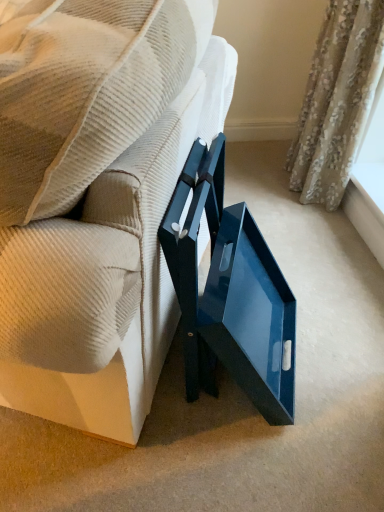
Describe the element at coordinates (337, 100) in the screenshot. I see `floral fabric curtain at upper right` at that location.

Identify the location of white textured window sill at upper right. The image size is (384, 512). (365, 217).

Which of these two, white textured window sill at upper right or floral fabric curtain at upper right, is smaller?

white textured window sill at upper right.

Based on the photo, from the image's perspective, between white textured window sill at upper right and floral fabric curtain at upper right, which one is located above?

floral fabric curtain at upper right.

Can you tell me how much white textured window sill at upper right and floral fabric curtain at upper right differ in facing direction?

white textured window sill at upper right and floral fabric curtain at upper right are facing 0.00149 degrees away from each other.

Can you see glossy blue tray at center touching floral fabric curtain at upper right?

No, glossy blue tray at center is not with floral fabric curtain at upper right.

What's the angular difference between glossy blue tray at center and floral fabric curtain at upper right's facing directions?

23 degrees.

Considering the relative sizes of glossy blue tray at center and floral fabric curtain at upper right in the image provided, is glossy blue tray at center shorter than floral fabric curtain at upper right?

In fact, glossy blue tray at center may be taller than floral fabric curtain at upper right.

Considering the positions of points (122, 277) and (349, 165), is point (122, 277) closer to camera compared to point (349, 165)?

That is True.

Does floral fabric curtain at upper right appear on the right side of glossy blue tray at center?

Yes.

Is floral fabric curtain at upper right directly adjacent to glossy blue tray at center?

No, floral fabric curtain at upper right is not touching glossy blue tray at center.

Considering the sizes of objects floral fabric curtain at upper right and glossy blue tray at center in the image provided, who is bigger, floral fabric curtain at upper right or glossy blue tray at center?

glossy blue tray at center is bigger.

Can you tell me how much floral fabric curtain at upper right and glossy blue tray at center differ in facing direction?

The angle between the facing direction of floral fabric curtain at upper right and the facing direction of glossy blue tray at center is 23 degrees.

Is white textured window sill at upper right a part of floral fabric curtain at upper right?

No.

Which object is further away from the camera, floral fabric curtain at upper right or white textured window sill at upper right?

white textured window sill at upper right is further away from the camera.

Is point (345, 172) farther from camera compared to point (375, 231)?

Yes, it is.

Considering the positions of objects floral fabric curtain at upper right and white textured window sill at upper right in the image provided, who is more to the right, floral fabric curtain at upper right or white textured window sill at upper right?

white textured window sill at upper right.

From the image's perspective, relative to glossy blue tray at center, is white textured window sill at upper right above or below?

Clearly, from the image's perspective, white textured window sill at upper right is below glossy blue tray at center.

Is white textured window sill at upper right to the right of glossy blue tray at center from the viewer's perspective?

Indeed, white textured window sill at upper right is positioned on the right side of glossy blue tray at center.

Which of these two, white textured window sill at upper right or glossy blue tray at center, stands taller?

glossy blue tray at center.

Looking at their sizes, would you say white textured window sill at upper right is wider or thinner than glossy blue tray at center?

Considering their sizes, white textured window sill at upper right looks slimmer than glossy blue tray at center.

From a real-world perspective, which is physically above, glossy blue tray at center or white textured window sill at upper right?

glossy blue tray at center, from a real-world perspective.

Looking at their sizes, would you say glossy blue tray at center is wider or thinner than white textured window sill at upper right?

In the image, glossy blue tray at center appears to be wider than white textured window sill at upper right.

Is glossy blue tray at center oriented away from white textured window sill at upper right?

Correct, glossy blue tray at center is looking away from white textured window sill at upper right.

The image size is (384, 512). What are the coordinates of `window sill below the glossy blue tray at center (from the image's perspective)` in the screenshot? It's located at (365, 217).

Locate an element on the screen. curtain that is above the white textured window sill at upper right (from the image's perspective) is located at coordinates (337, 100).

This screenshot has height=512, width=384. I want to click on curtain on the right of glossy blue tray at center, so click(337, 100).

Estimate the real-world distances between objects in this image. Which object is further from white textured window sill at upper right, floral fabric curtain at upper right or glossy blue tray at center?

Among the two, glossy blue tray at center is located further to white textured window sill at upper right.

Looking at the image, which one is located closer to floral fabric curtain at upper right, white textured window sill at upper right or glossy blue tray at center?

white textured window sill at upper right is closer to floral fabric curtain at upper right.

From the image, which object appears to be nearer to floral fabric curtain at upper right, glossy blue tray at center or white textured window sill at upper right?

The object closer to floral fabric curtain at upper right is white textured window sill at upper right.

Which object lies nearer to the anchor point glossy blue tray at center, white textured window sill at upper right or floral fabric curtain at upper right?

floral fabric curtain at upper right is closer to glossy blue tray at center.

When comparing their distances from white textured window sill at upper right, does glossy blue tray at center or floral fabric curtain at upper right seem closer?

floral fabric curtain at upper right lies closer to white textured window sill at upper right than the other object.

Based on their spatial positions, is floral fabric curtain at upper right or white textured window sill at upper right further from glossy blue tray at center?

The object further to glossy blue tray at center is white textured window sill at upper right.

You are a GUI agent. You are given a task and a screenshot of the screen. Output one action in this format:
    pyautogui.click(x=<x>, y=<y>)
    Task: Click on the curtain located between glossy blue tray at center and white textured window sill at upper right in the left-right direction
    The image size is (384, 512).
    Given the screenshot: What is the action you would take?
    pyautogui.click(x=337, y=100)